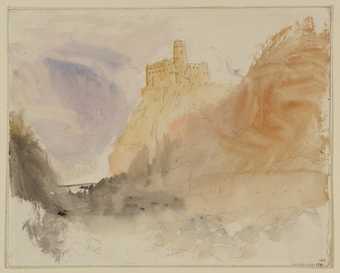
Where is `painting`? This screenshot has height=273, width=340. painting is located at coordinates (108, 123).